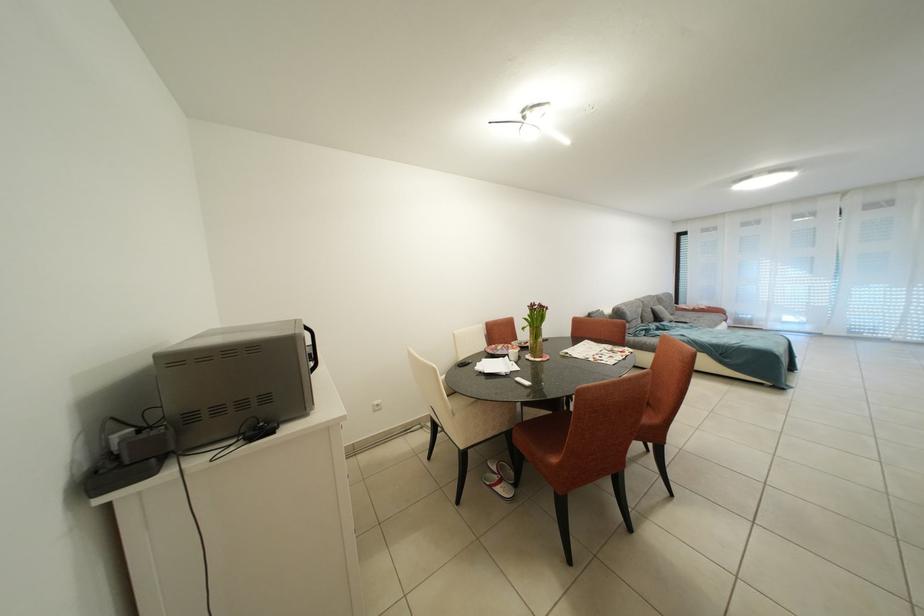
Image resolution: width=924 pixels, height=616 pixels. Identify the location of gray sofa sitting surface. (688, 315).